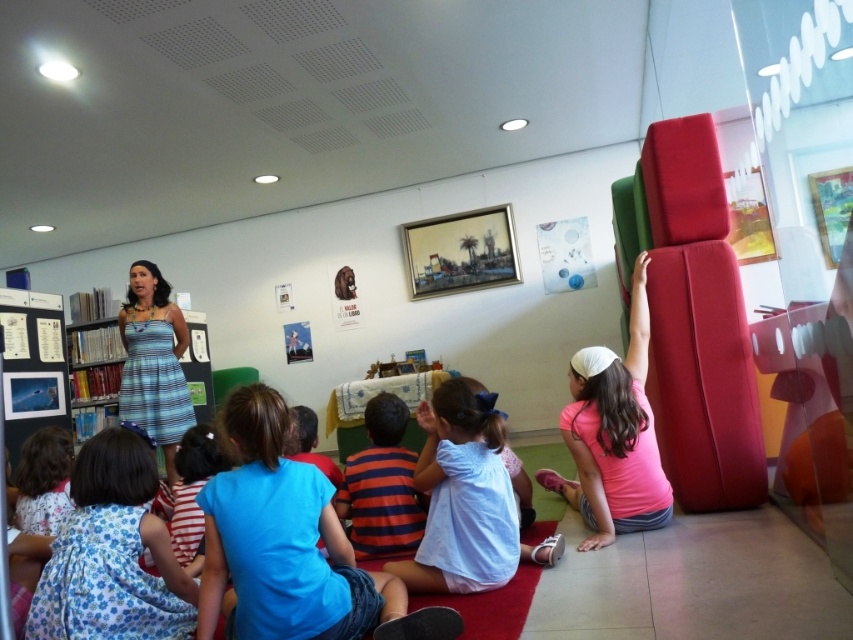
Based on the scene description, where is the floral cotton dress at lower left located in terms of its 2D coordinates?

The floral cotton dress at lower left is located at the 2D coordinate point of (112, 552).

You are a photographer trying to capture a clear shot of both the floral cotton dress at lower left and the pink matte shirt at right. Since you want to ensure both are visible, which object should you focus on first considering their sizes?

The floral cotton dress at lower left has a smaller size compared to the pink matte shirt at right, so you should focus on the floral cotton dress at lower left first to ensure its details are captured clearly before adjusting for the larger pink matte shirt at right.

You are a photographer trying to capture a candid shot of the two speakers in the scene. The floral cotton dress at lower left and the pink matte shirt at right are both part of the setup. Which speaker is shorter?

The floral cotton dress at lower left is not as tall as the pink matte shirt at right, so the speaker in the floral cotton dress at lower left is shorter.